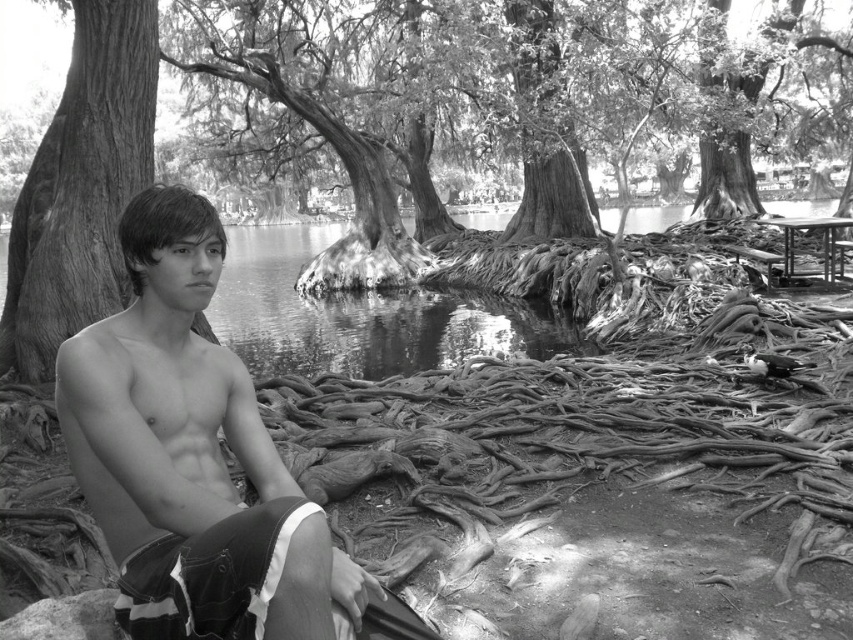
In order to click on smooth bark tree trunk at left in this screenshot , I will do `click(80, 186)`.

Where is `smooth bark tree trunk at left`? The height and width of the screenshot is (640, 853). smooth bark tree trunk at left is located at coordinates (80, 186).

Does smooth denim shorts at center have a greater height compared to smooth bark tree trunk at left?

Incorrect, smooth denim shorts at center's height is not larger of smooth bark tree trunk at left's.

Between smooth denim shorts at center and smooth bark tree trunk at left, which one is positioned lower?

smooth denim shorts at center is below.

Find the location of a particular element. This screenshot has height=640, width=853. smooth denim shorts at center is located at coordinates (170, 413).

What are the coordinates of `smooth denim shorts at center` in the screenshot? It's located at 170,413.

Can you confirm if smooth denim shorts at center is shorter than wooden picnic table at right?

Correct, smooth denim shorts at center is not as tall as wooden picnic table at right.

Who is more forward, (326, 589) or (785, 221)?

Point (326, 589) is more forward.

Find the location of a particular element. smooth denim shorts at center is located at coordinates (170, 413).